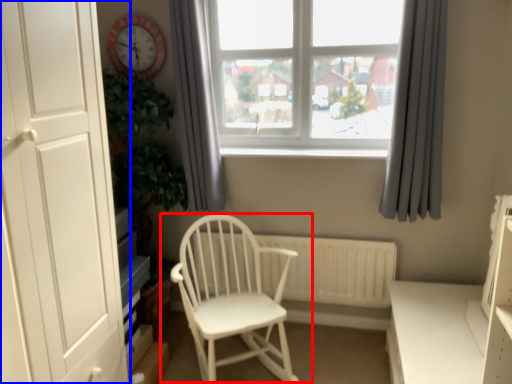
Question: Which point is further to the camera, chair (highlighted by a red box) or door (highlighted by a blue box)?

Choices:
 (A) chair
 (B) door

Answer: (A)